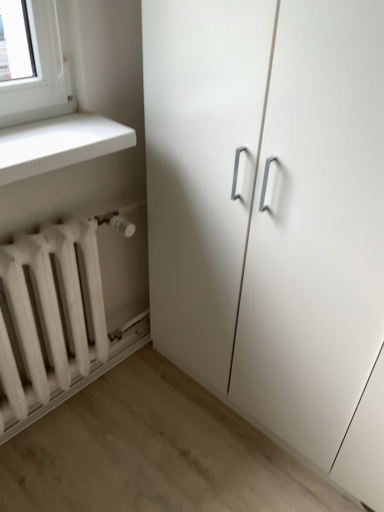
Question: Is white matte radiator at lower left at the right side of white matte cabinet at center?

Choices:
 (A) yes
 (B) no

Answer: (B)

Question: Is white matte radiator at lower left smaller than white matte cabinet at center?

Choices:
 (A) yes
 (B) no

Answer: (A)

Question: From a real-world perspective, is white matte radiator at lower left located higher than white matte cabinet at center?

Choices:
 (A) no
 (B) yes

Answer: (A)

Question: Is white matte radiator at lower left completely or partially outside of white matte cabinet at center?

Choices:
 (A) no
 (B) yes

Answer: (B)

Question: Does white matte radiator at lower left turn towards white matte cabinet at center?

Choices:
 (A) no
 (B) yes

Answer: (A)

Question: Would you say white matte radiator at lower left is a long distance from white matte cabinet at center?

Choices:
 (A) yes
 (B) no

Answer: (B)

Question: Considering the relative sizes of white matte cabinet at center and white matte radiator at lower left in the image provided, is white matte cabinet at center wider than white matte radiator at lower left?

Choices:
 (A) yes
 (B) no

Answer: (A)

Question: Is white matte cabinet at center shorter than white matte radiator at lower left?

Choices:
 (A) no
 (B) yes

Answer: (A)

Question: Is white matte cabinet at center positioned with its back to white matte radiator at lower left?

Choices:
 (A) yes
 (B) no

Answer: (B)

Question: Is white matte cabinet at center at the right side of white matte radiator at lower left?

Choices:
 (A) yes
 (B) no

Answer: (A)

Question: Is white matte cabinet at center positioned before white matte radiator at lower left?

Choices:
 (A) yes
 (B) no

Answer: (A)

Question: From a real-world perspective, is white matte cabinet at center located higher than white matte radiator at lower left?

Choices:
 (A) no
 (B) yes

Answer: (B)

Question: Based on their sizes in the image, would you say white matte cabinet at center is bigger or smaller than white matte radiator at lower left?

Choices:
 (A) small
 (B) big

Answer: (B)